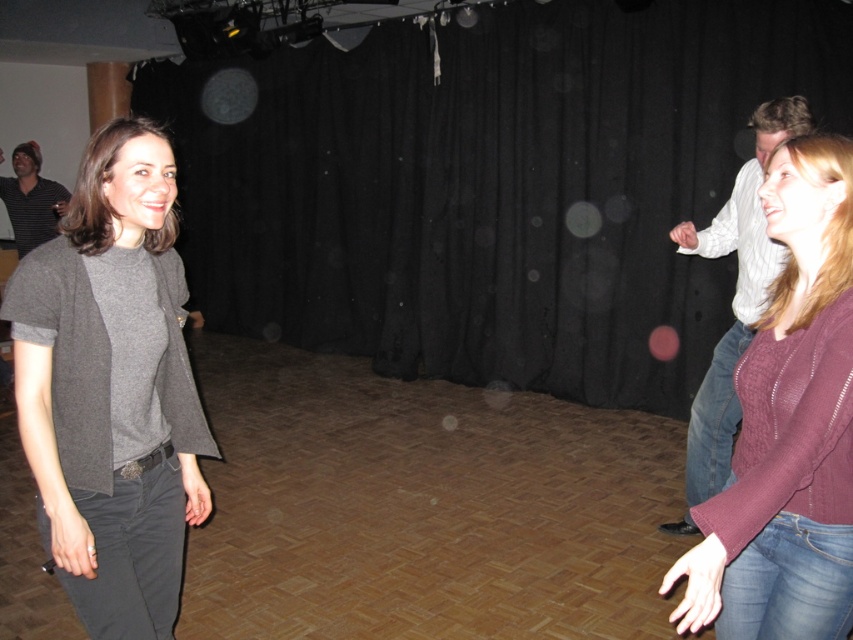
You are observing two people in a dance studio. The gray wool sweater at left is worn by a woman, and the white striped shirt at right is worn by another person. Which person appears shorter in height?

The gray wool sweater at left is not as tall as the white striped shirt at right, so the person wearing the gray wool sweater at left appears shorter in height.

You are a fashion designer analyzing the outfit of a model in the image. The model is wearing dark gray cotton jeans at lower left and a striped cotton shirt at left. Which clothing item is shorter in length?

The dark gray cotton jeans at lower left is shorter than the striped cotton shirt at left.

You are organizing a clothing donation drive and need to categorize items based on their size. You have two garments in front of you, the gray wool sweater at left and the white striped shirt at right. Which garment has a smaller width?

The gray wool sweater at left has a smaller width than the white striped shirt at right according to the description.